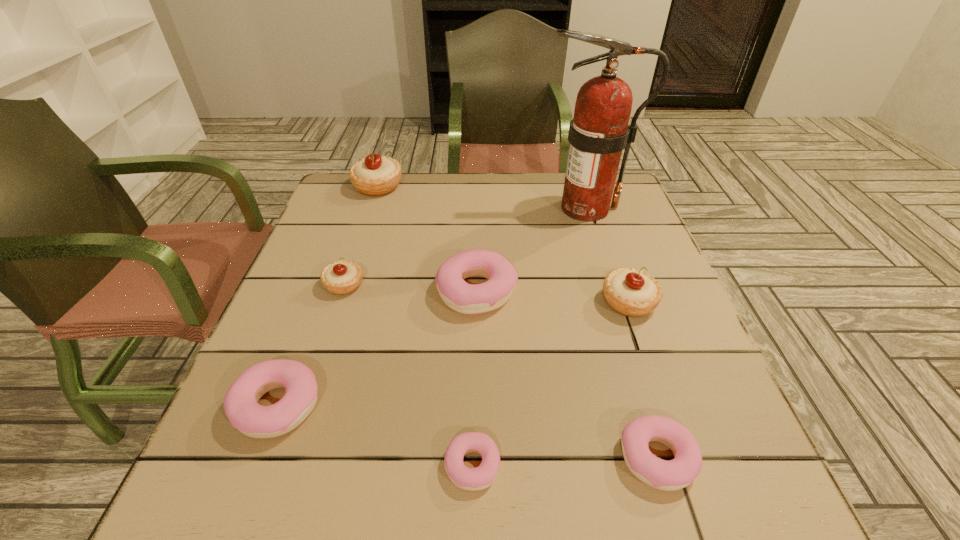
The width and height of the screenshot is (960, 540). In order to click on vacant area at the far edge in this screenshot , I will do `click(492, 186)`.

Where is `free space at the near edge of the desktop`? free space at the near edge of the desktop is located at coordinates (502, 523).

Identify the location of free region at the left edge of the desktop. The height and width of the screenshot is (540, 960). (265, 334).

The height and width of the screenshot is (540, 960). I want to click on free space at the right edge, so click(604, 246).

This screenshot has height=540, width=960. I want to click on vacant space at the far left corner, so click(332, 189).

The width and height of the screenshot is (960, 540). In the image, there is a desktop. What are the coordinates of `free space at the near right corner` in the screenshot? It's located at (756, 488).

The height and width of the screenshot is (540, 960). In order to click on free area in between the smallest beige pastry and the leftmost pink pastry in this screenshot , I will do `click(311, 345)`.

You are a GUI agent. You are given a task and a screenshot of the screen. Output one action in this format:
    pyautogui.click(x=<x>, y=<y>)
    Task: Click on the free space between the fire extinguisher and the biggest beige pastry
    
    Given the screenshot: What is the action you would take?
    pyautogui.click(x=482, y=197)

The image size is (960, 540). Identify the location of free space between the smallest beige pastry and the tallest pastry. (361, 235).

Find the location of a particular element. free area in between the biggest pink pastry and the smallest beige pastry is located at coordinates (411, 288).